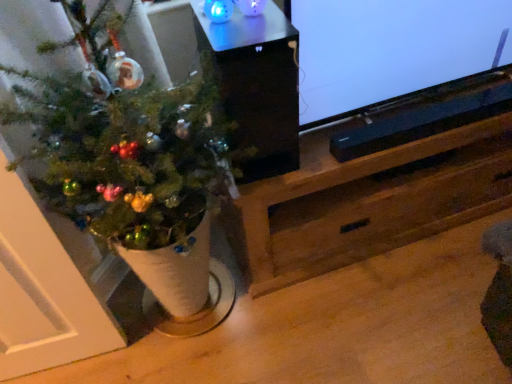
This screenshot has width=512, height=384. Identify the location of free region under black plastic soundbar at lower center (from a real-world perspective). (414, 235).